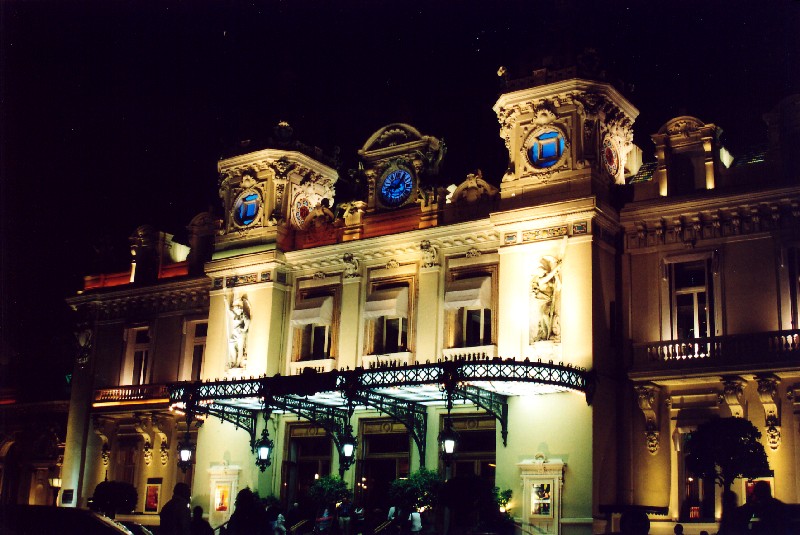
This screenshot has width=800, height=535. In order to click on brown pot in this screenshot , I will do `click(694, 516)`.